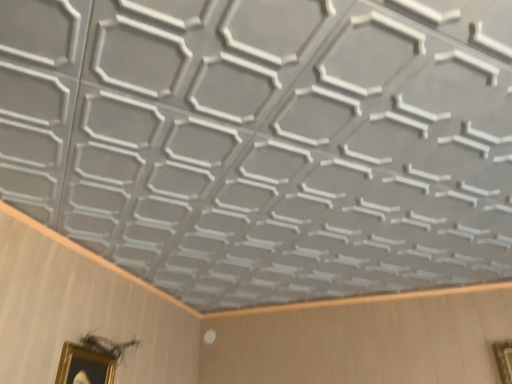
Where is `gold metallic picture frame at lower left`? The width and height of the screenshot is (512, 384). gold metallic picture frame at lower left is located at coordinates (85, 366).

This screenshot has height=384, width=512. Describe the element at coordinates (85, 366) in the screenshot. I see `gold metallic picture frame at lower left` at that location.

Find the location of a particular element. Image resolution: width=512 pixels, height=384 pixels. gold metallic picture frame at lower left is located at coordinates (85, 366).